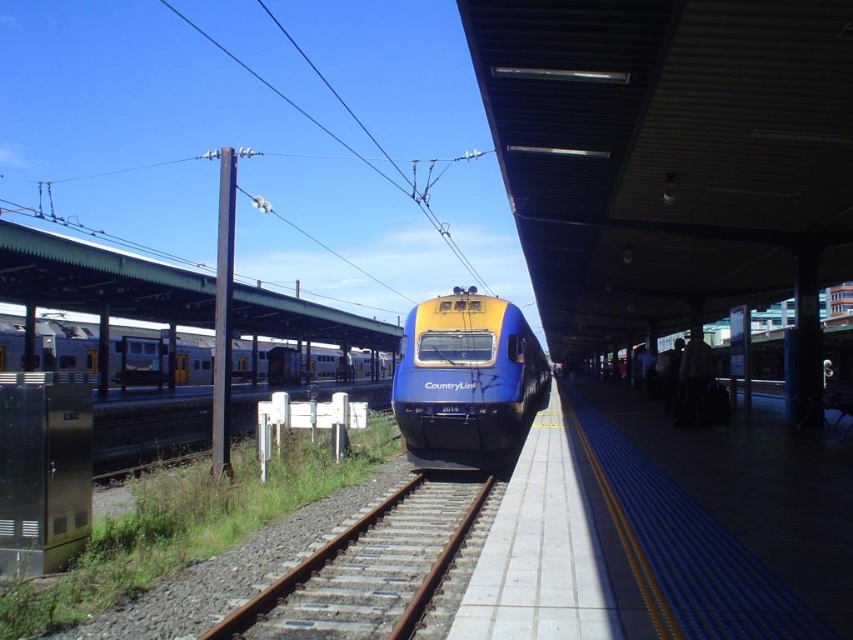
You are standing at the camera position and want to walk to point (469, 432). Is the distance more than 30 feet?

Yes, the distance between the camera and point (469, 432) is 39.24 feet, which is more than 30 feet.

You are standing at point (68, 355) and want to walk to the train. Which direction should you go relative to point (346, 628)?

You should move forward towards the train, as point (346, 628) is in front of point (68, 355).

You are standing at the train station and want to reach the point marked as point (x=444, y=541). If you walk straight ahead, will you reach it before walking 10 meters?

The point (x=444, y=541) is 8.65 meters away from the viewer, so yes, you will reach it before walking 10 meters.